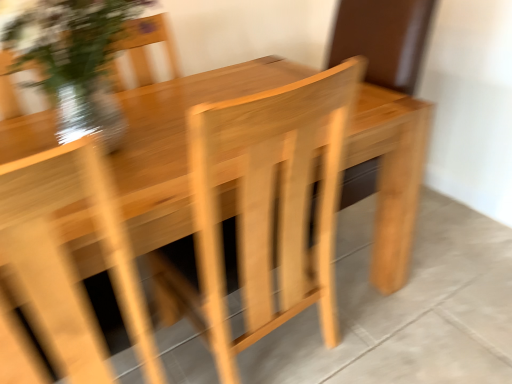
Question: Does natural wood armchair at center touch natural wood table at center?

Choices:
 (A) no
 (B) yes

Answer: (A)

Question: Can you confirm if natural wood armchair at center is wider than natural wood table at center?

Choices:
 (A) no
 (B) yes

Answer: (A)

Question: Does natural wood armchair at center have a larger size compared to natural wood table at center?

Choices:
 (A) no
 (B) yes

Answer: (B)

Question: Is natural wood armchair at center to the right of natural wood table at center from the viewer's perspective?

Choices:
 (A) yes
 (B) no

Answer: (B)

Question: Considering the relative sizes of natural wood armchair at center and natural wood table at center in the image provided, is natural wood armchair at center thinner than natural wood table at center?

Choices:
 (A) yes
 (B) no

Answer: (A)

Question: Is natural wood table at center to the left or to the right of translucent glass vase at upper left in the image?

Choices:
 (A) left
 (B) right

Answer: (B)

Question: From the image's perspective, is natural wood table at center located above or below translucent glass vase at upper left?

Choices:
 (A) above
 (B) below

Answer: (B)

Question: In the image, is natural wood table at center positioned in front of or behind translucent glass vase at upper left?

Choices:
 (A) front
 (B) behind

Answer: (B)

Question: From their relative heights in the image, would you say natural wood table at center is taller or shorter than translucent glass vase at upper left?

Choices:
 (A) short
 (B) tall

Answer: (A)

Question: Considering the positions of natural wood armchair at center and natural wood table at center in the image, is natural wood armchair at center wider or thinner than natural wood table at center?

Choices:
 (A) thin
 (B) wide

Answer: (A)

Question: In terms of height, does natural wood armchair at center look taller or shorter compared to natural wood table at center?

Choices:
 (A) tall
 (B) short

Answer: (A)

Question: From the image's perspective, relative to natural wood table at center, is natural wood armchair at center above or below?

Choices:
 (A) above
 (B) below

Answer: (A)

Question: From a real-world perspective, relative to natural wood table at center, is natural wood armchair at center vertically above or below?

Choices:
 (A) above
 (B) below

Answer: (A)

Question: Is translucent glass vase at upper left wider or thinner than natural wood table at center?

Choices:
 (A) thin
 (B) wide

Answer: (A)

Question: From the image's perspective, is translucent glass vase at upper left located above or below natural wood table at center?

Choices:
 (A) below
 (B) above

Answer: (B)